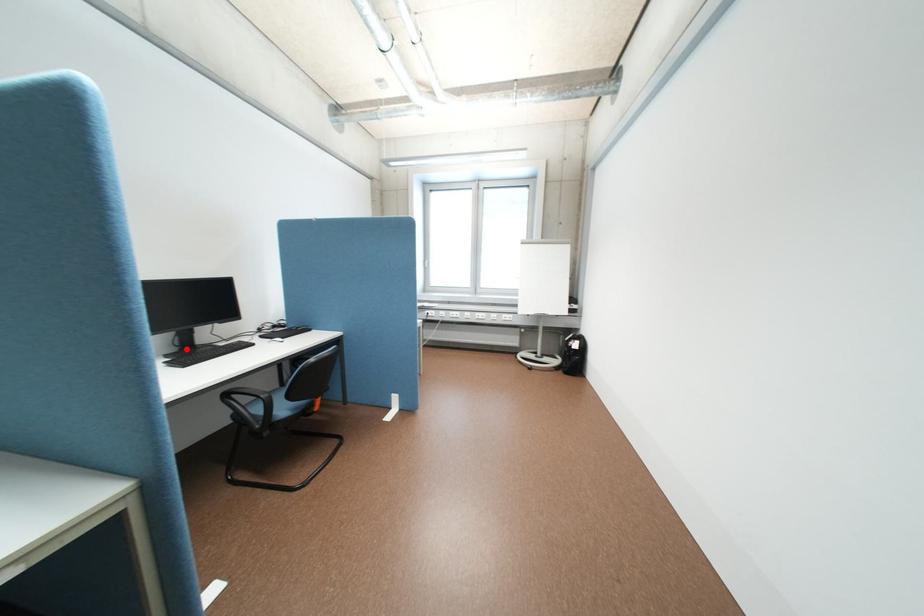
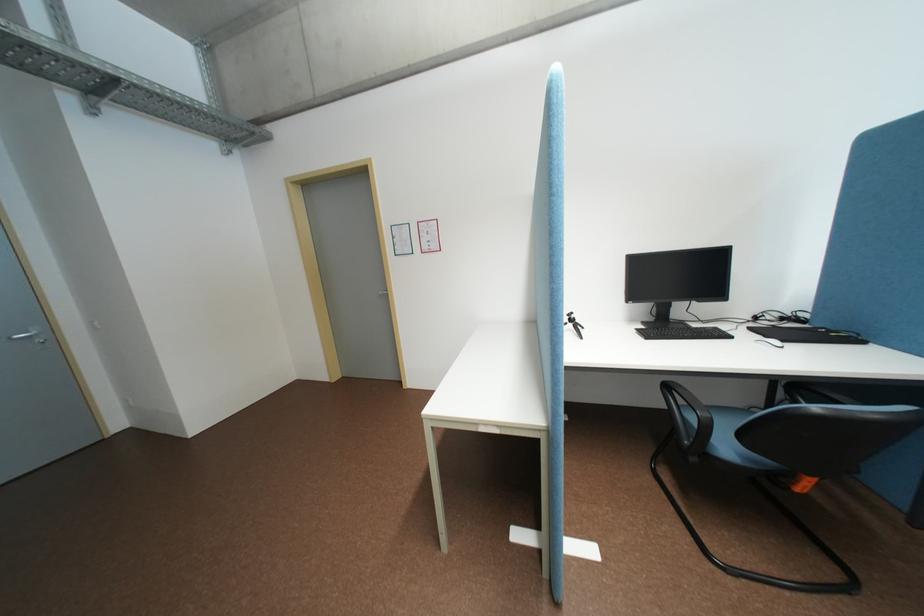
The point at the highlighted location is marked in the first image. Where is the corresponding point in the second image?

(662, 318)